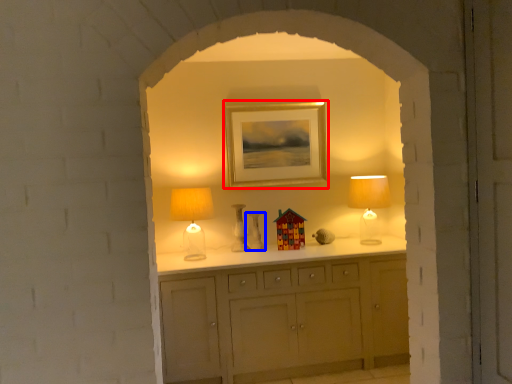
Question: Which point is further to the camera, picture frame (highlighted by a red box) or vase (highlighted by a blue box)?

Choices:
 (A) picture frame
 (B) vase

Answer: (A)